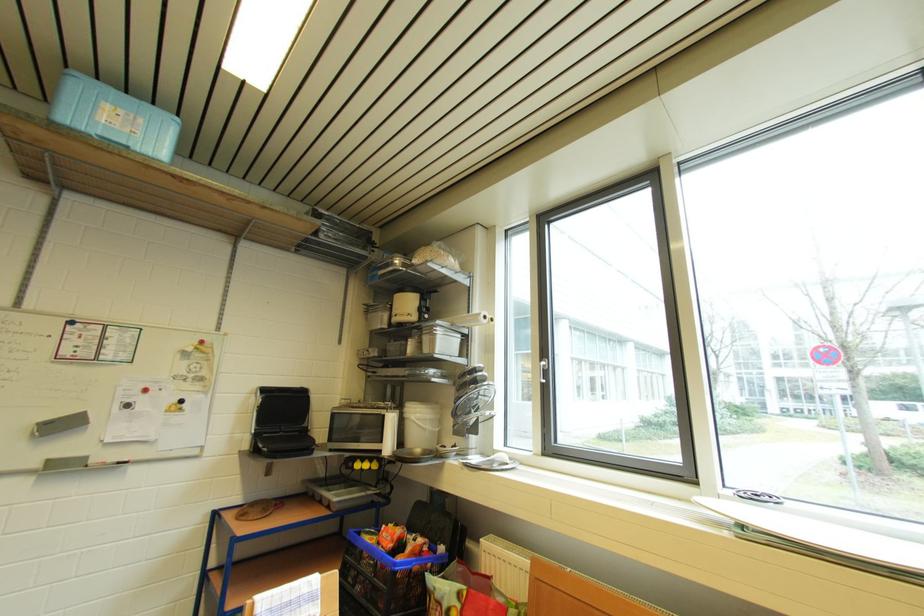
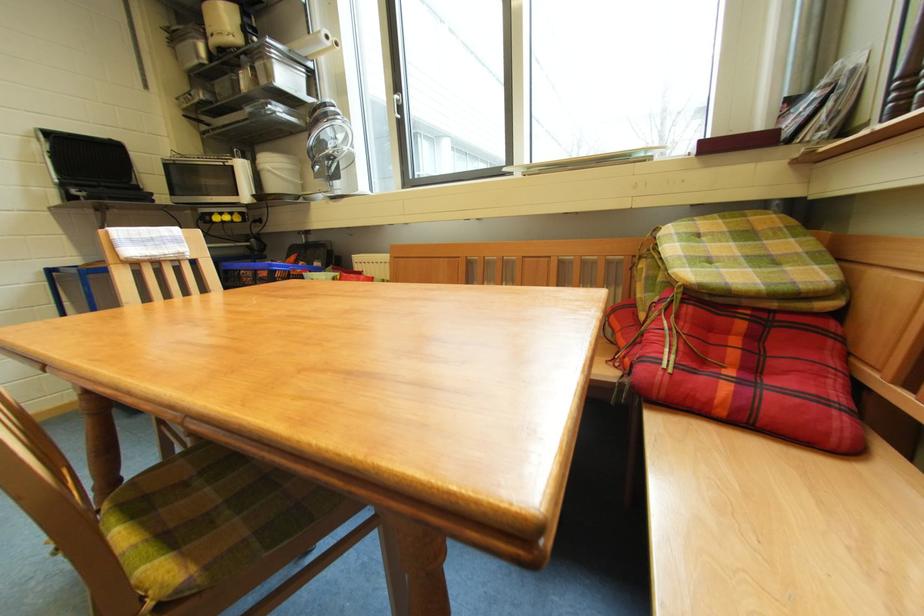
Locate, in the second image, the point that corresponds to point 466,382 in the first image.

(319, 121)